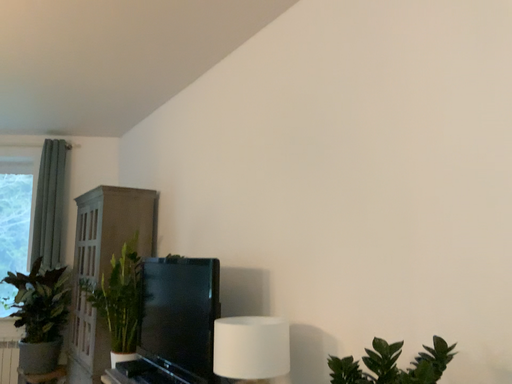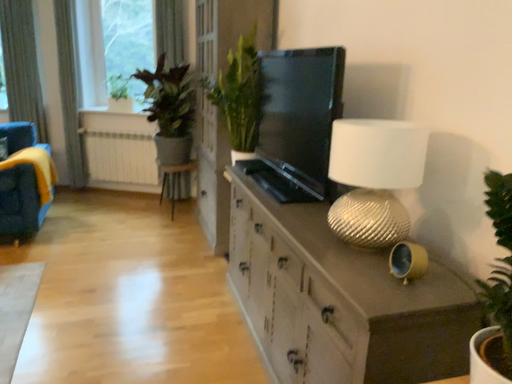
Question: Which way did the camera rotate in the video?

Choices:
 (A) rotated left
 (B) rotated right

Answer: (A)